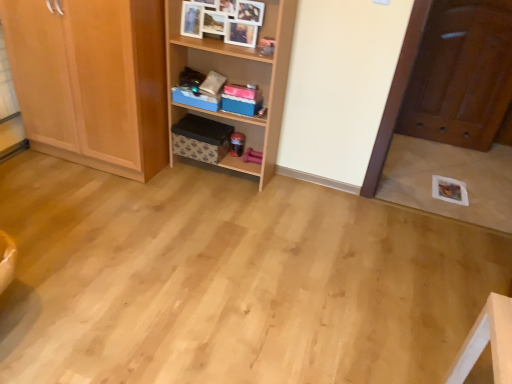
Question: Looking at their shapes, would you say brown cardboard box at center is wider or thinner than blue fabric storage box at center?

Choices:
 (A) thin
 (B) wide

Answer: (B)

Question: From their relative heights in the image, would you say brown cardboard box at center is taller or shorter than blue fabric storage box at center?

Choices:
 (A) tall
 (B) short

Answer: (A)

Question: Estimate the real-world distances between objects in this image. Which object is farther from the brown cardboard box at center?

Choices:
 (A) wooden cabinet at upper center
 (B) shiny brown door at right
 (C) light wood cabinet at left
 (D) blue fabric storage box at center
 (E) wooden shelf at center

Answer: (B)

Question: Considering the real-world distances, which object is closest to the blue fabric storage box at center?

Choices:
 (A) light wood cabinet at left
 (B) wooden cabinet at upper center
 (C) brown cardboard box at center
 (D) shiny brown door at right
 (E) wooden shelf at center

Answer: (C)